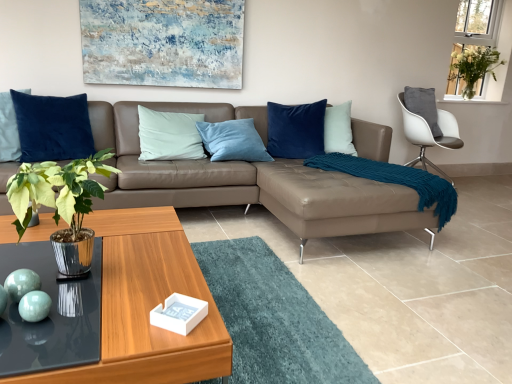
Question: Does teal knitted blanket at right touch transparent glass table at lower left?

Choices:
 (A) no
 (B) yes

Answer: (A)

Question: Does teal knitted blanket at right contain transparent glass table at lower left?

Choices:
 (A) yes
 (B) no

Answer: (B)

Question: Can you confirm if teal knitted blanket at right is bigger than transparent glass table at lower left?

Choices:
 (A) yes
 (B) no

Answer: (A)

Question: Is teal knitted blanket at right to the left of transparent glass table at lower left from the viewer's perspective?

Choices:
 (A) no
 (B) yes

Answer: (A)

Question: From the image's perspective, is teal knitted blanket at right on top of transparent glass table at lower left?

Choices:
 (A) yes
 (B) no

Answer: (A)

Question: Is teal knitted blanket at right smaller than transparent glass table at lower left?

Choices:
 (A) no
 (B) yes

Answer: (A)

Question: Are shiny metallic plant at center-left and transparent glass table at lower left making contact?

Choices:
 (A) no
 (B) yes

Answer: (A)

Question: From the image's perspective, would you say shiny metallic plant at center-left is shown under transparent glass table at lower left?

Choices:
 (A) no
 (B) yes

Answer: (A)

Question: Are shiny metallic plant at center-left and transparent glass table at lower left located far from each other?

Choices:
 (A) no
 (B) yes

Answer: (A)

Question: Can transparent glass table at lower left be found inside shiny metallic plant at center-left?

Choices:
 (A) yes
 (B) no

Answer: (B)

Question: Can you confirm if shiny metallic plant at center-left is shorter than transparent glass table at lower left?

Choices:
 (A) no
 (B) yes

Answer: (A)

Question: Is shiny metallic plant at center-left closer to camera compared to transparent glass table at lower left?

Choices:
 (A) no
 (B) yes

Answer: (A)

Question: Does teal glossy spheres at lower left, the first teal in the left-to-right sequence, have a greater width compared to transparent glass table at lower left?

Choices:
 (A) no
 (B) yes

Answer: (A)